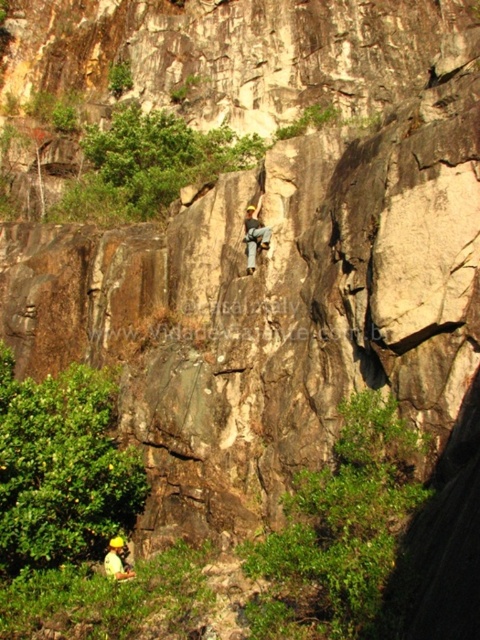
You are a safety inspector assessing the rock climbing setup. You notice the light brown leather harness at center and the yellow helmeted climber at center. According to safety protocols, which object should be placed above the other?

The light brown leather harness at center should be positioned over the yellow helmeted climber at center to ensure proper safety compliance, as the harness is meant to secure the climber during the ascent.

You are a rock climber preparing to secure your harness. The light brown leather harness at center is located at point (x=254, y=234). Where should you position your harness to ensure it is correctly attached?

The light brown leather harness at center is located at point (x=254, y=234), so you should position your harness at that exact coordinate to ensure proper attachment.